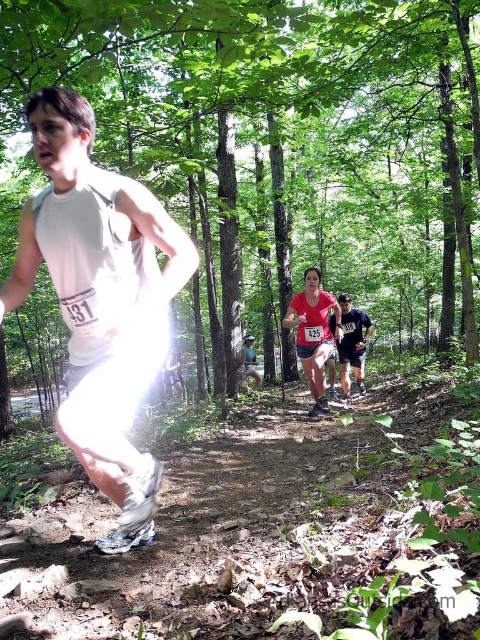
Is matte pink tank top at center closer to camera compared to dark blue jersey at center?

Yes, matte pink tank top at center is in front of dark blue jersey at center.

Which is behind, point (316, 360) or point (340, 376)?

The point (340, 376) is behind.

In order to click on matte pink tank top at center in this screenshot , I will do `click(313, 333)`.

Is white matte shorts at center above matte pink tank top at center?

Indeed, white matte shorts at center is positioned over matte pink tank top at center.

Between point (82, 330) and point (327, 356), which one is positioned behind?

The point (327, 356) is behind.

Who is more forward, (x=83, y=211) or (x=334, y=336)?

Positioned in front is point (x=83, y=211).

The height and width of the screenshot is (640, 480). In order to click on white matte shorts at center in this screenshot , I will do [x=100, y=300].

Is white matte shorts at center wider than dark blue jersey at center?

Correct, the width of white matte shorts at center exceeds that of dark blue jersey at center.

How far apart are white matte shorts at center and dark blue jersey at center?

A distance of 5.57 meters exists between white matte shorts at center and dark blue jersey at center.

Does point (72, 378) come behind point (339, 353)?

No, (72, 378) is in front of (339, 353).

This screenshot has width=480, height=640. In order to click on white matte shorts at center in this screenshot , I will do `click(100, 300)`.